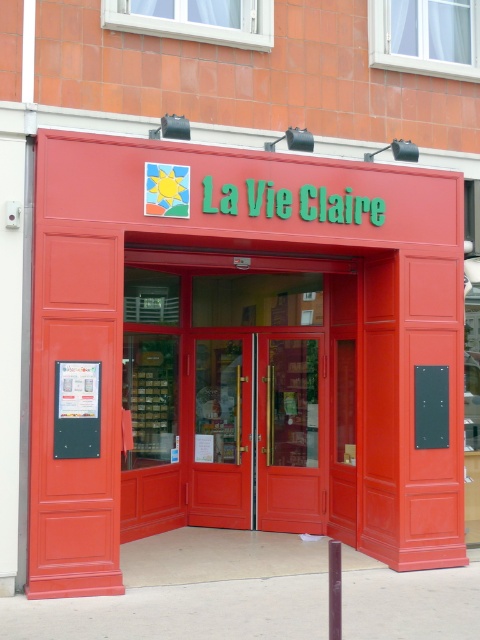
Question: Which of these objects is positioned farthest from the matte red doors at center?

Choices:
 (A) metallic pole at center
 (B) red glossy door at center
 (C) matte red door at center
 (D) smooth glossy door at center

Answer: (A)

Question: Is smooth glossy door at center further to camera compared to metallic pole at center?

Choices:
 (A) yes
 (B) no

Answer: (A)

Question: Based on their relative distances, which object is nearer to the matte red doors at center?

Choices:
 (A) metallic pole at center
 (B) smooth glossy door at center
 (C) matte red door at center
 (D) red glossy door at center

Answer: (D)

Question: Can you confirm if matte red doors at center is thinner than matte red door at center?

Choices:
 (A) no
 (B) yes

Answer: (B)

Question: Does matte red door at center have a smaller size compared to red glossy door at center?

Choices:
 (A) yes
 (B) no

Answer: (A)

Question: Which object appears closest to the camera in this image?

Choices:
 (A) matte red door at center
 (B) red glossy door at center

Answer: (A)